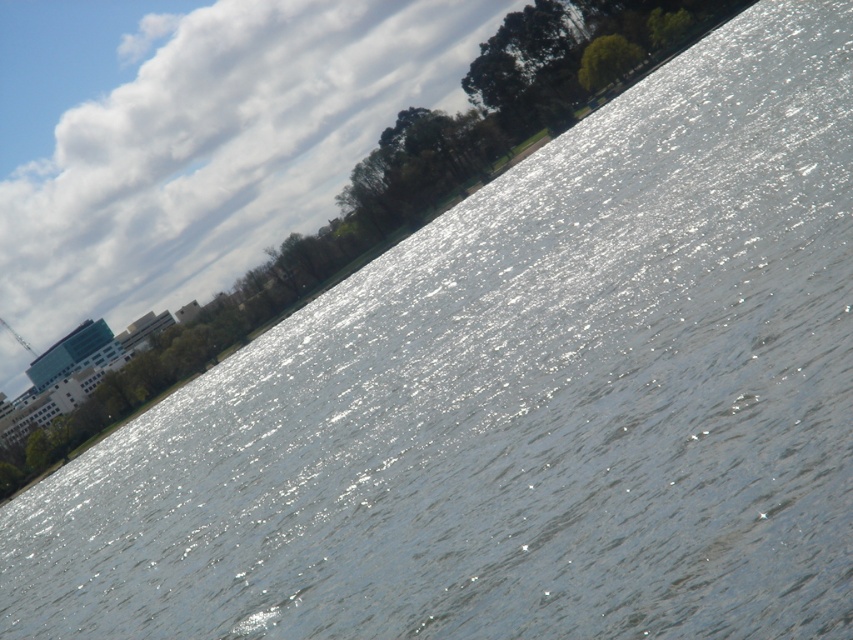
Question: Can you confirm if white fluffy cloud at upper left is positioned to the left of green leafy tree at upper center?

Choices:
 (A) no
 (B) yes

Answer: (B)

Question: Is white fluffy cloud at upper left below green leafy tree at upper center?

Choices:
 (A) yes
 (B) no

Answer: (B)

Question: Does white fluffy cloud at upper left lie behind green leafy tree at upper center?

Choices:
 (A) no
 (B) yes

Answer: (B)

Question: Which object is farther from the camera taking this photo?

Choices:
 (A) white fluffy cloud at upper left
 (B) green leafy tree at upper center

Answer: (A)